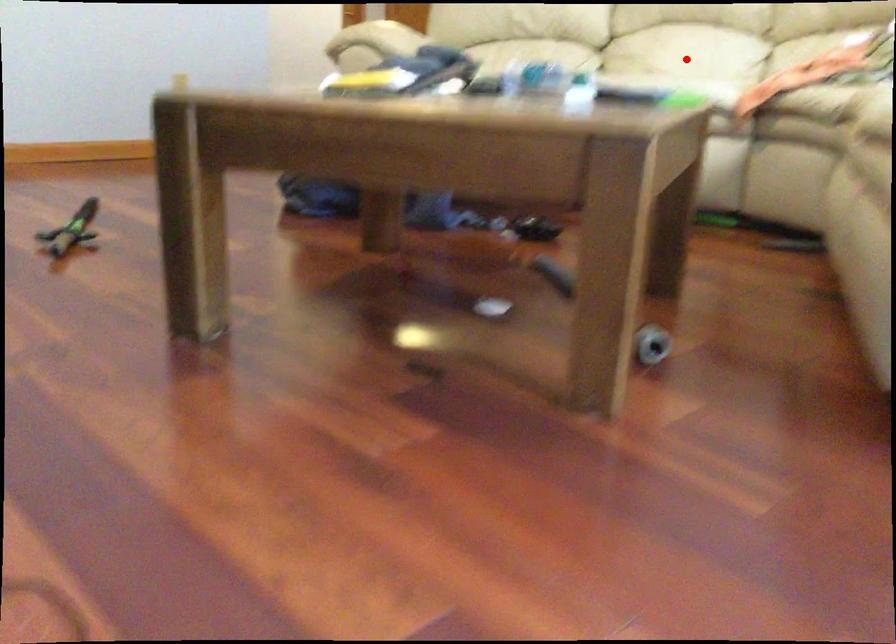
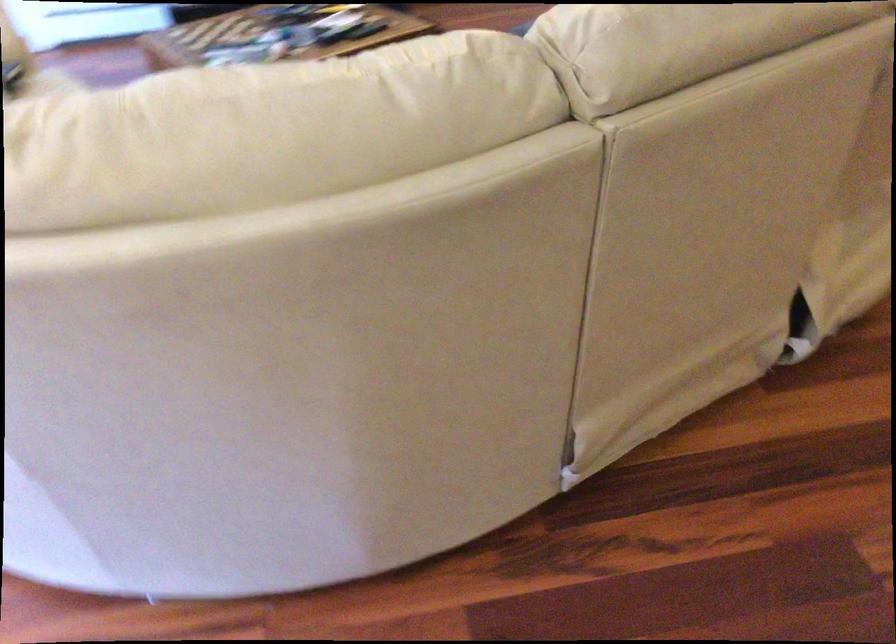
Question: I am providing you with two images of the same scene from different viewpoints. A red point is marked on the first image. At the location where the point appears in image 1, is it still visible in image 2?

Choices:
 (A) Yes
 (B) No

Answer: (B)